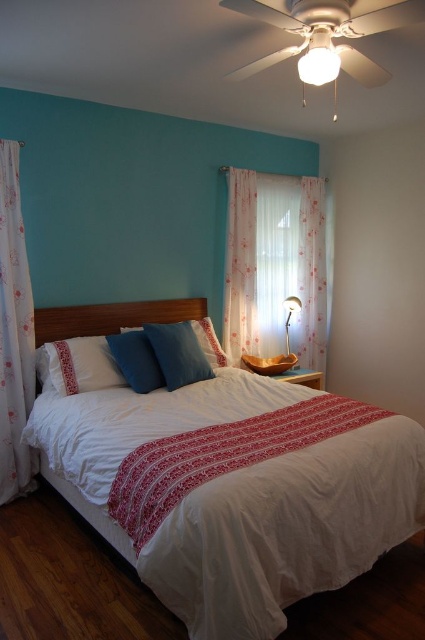
You are organizing a charity event and need to decide which item to donate first between the white textured blanket at center and the matte blue pillow at center. Since space is limited, which item should you prioritize donating based on size?

The white textured blanket at center is larger in size than the matte blue pillow at center, so you should prioritize donating the matte blue pillow at center first because it takes up less space.

You are standing at the foot of the bed and want to reach the wooden headboard at center and the white soft pillow at center. Which object will you encounter first as you move towards the headboard?

You will encounter the wooden headboard at center first because it is closer to you than the white soft pillow at center, which is positioned behind it.